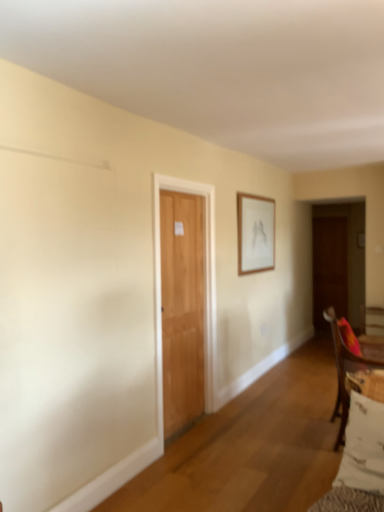
At what (x,y) coordinates should I click in order to perform the action: click on vacant region in front of light brown wooden door at center, the first door when ordered from front to back. Please return your answer as a coordinate pair (x, y). Looking at the image, I should click on (196, 462).